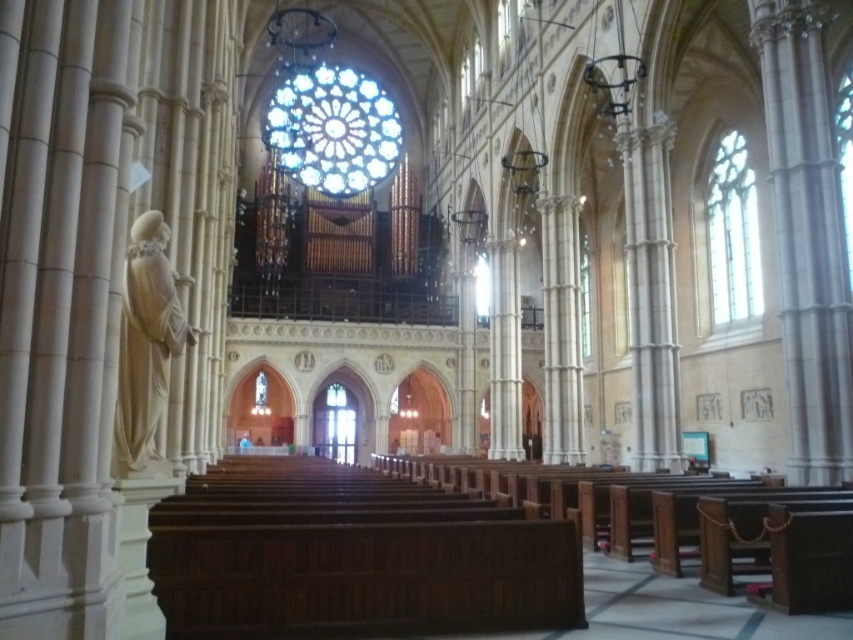
Question: Which point appears farthest from the camera in this image?

Choices:
 (A) 357,160
 (B) 757,273

Answer: (A)

Question: Which object appears farthest from the camera in this image?

Choices:
 (A) clear glass window at right
 (B) stained glass window at center

Answer: (B)

Question: Is stained glass window at center thinner than clear glass window at right?

Choices:
 (A) no
 (B) yes

Answer: (A)

Question: Can you confirm if stained glass window at center is thinner than clear glass window at right?

Choices:
 (A) yes
 (B) no

Answer: (B)

Question: Does stained glass window at center appear on the right side of clear glass window at right?

Choices:
 (A) yes
 (B) no

Answer: (B)